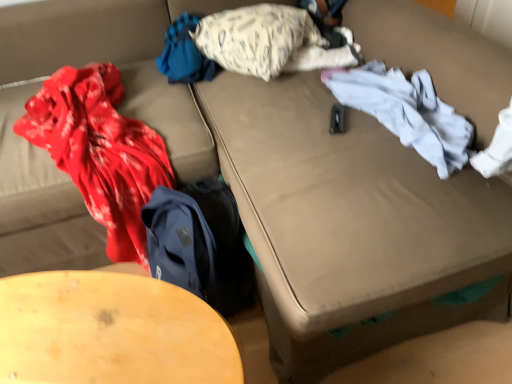
Question: Can you see white cotton shirt at right, the 2th clothing positioned from the left, touching wooden table at lower left?

Choices:
 (A) yes
 (B) no

Answer: (B)

Question: Is white cotton shirt at right, which appears as the first clothing when viewed from the right, facing towards wooden table at lower left?

Choices:
 (A) no
 (B) yes

Answer: (A)

Question: Is white cotton shirt at right, which appears as the first clothing when viewed from the right, bigger than wooden table at lower left?

Choices:
 (A) yes
 (B) no

Answer: (B)

Question: Does white cotton shirt at right, which appears as the first clothing when viewed from the right, have a lesser height compared to wooden table at lower left?

Choices:
 (A) no
 (B) yes

Answer: (B)

Question: From a real-world perspective, is white cotton shirt at right, which appears as the first clothing when viewed from the right, positioned under wooden table at lower left based on gravity?

Choices:
 (A) yes
 (B) no

Answer: (B)

Question: From the image's perspective, is blue fabric at upper center, the 1th clothing viewed from the left, positioned above or below white cotton shirt at right, the 2th clothing positioned from the left?

Choices:
 (A) above
 (B) below

Answer: (A)

Question: Is blue fabric at upper center, marked as the second clothing in a right-to-left arrangement, spatially inside white cotton shirt at right, the 2th clothing positioned from the left, or outside of it?

Choices:
 (A) outside
 (B) inside

Answer: (A)

Question: From a real-world perspective, relative to white cotton shirt at right, which appears as the first clothing when viewed from the right, is blue fabric at upper center, marked as the second clothing in a right-to-left arrangement, vertically above or below?

Choices:
 (A) above
 (B) below

Answer: (A)

Question: In the image, is blue fabric at upper center, the 1th clothing viewed from the left, positioned in front of or behind white cotton shirt at right, the 2th clothing positioned from the left?

Choices:
 (A) behind
 (B) front

Answer: (A)

Question: In the image, is white textured pillow at upper center on the left side or the right side of blue fabric at upper center, the 1th clothing viewed from the left?

Choices:
 (A) right
 (B) left

Answer: (A)

Question: Is point (224, 46) closer or farther from the camera than point (177, 34)?

Choices:
 (A) closer
 (B) farther

Answer: (A)

Question: Which is correct: white textured pillow at upper center is inside blue fabric at upper center, the 1th clothing viewed from the left, or outside of it?

Choices:
 (A) outside
 (B) inside

Answer: (A)

Question: In terms of height, does white textured pillow at upper center look taller or shorter compared to blue fabric at upper center, the 1th clothing viewed from the left?

Choices:
 (A) tall
 (B) short

Answer: (A)

Question: Based on their sizes in the image, would you say white textured pillow at upper center is bigger or smaller than wooden table at lower left?

Choices:
 (A) big
 (B) small

Answer: (B)

Question: From a real-world perspective, is white textured pillow at upper center positioned above or below wooden table at lower left?

Choices:
 (A) below
 (B) above

Answer: (B)